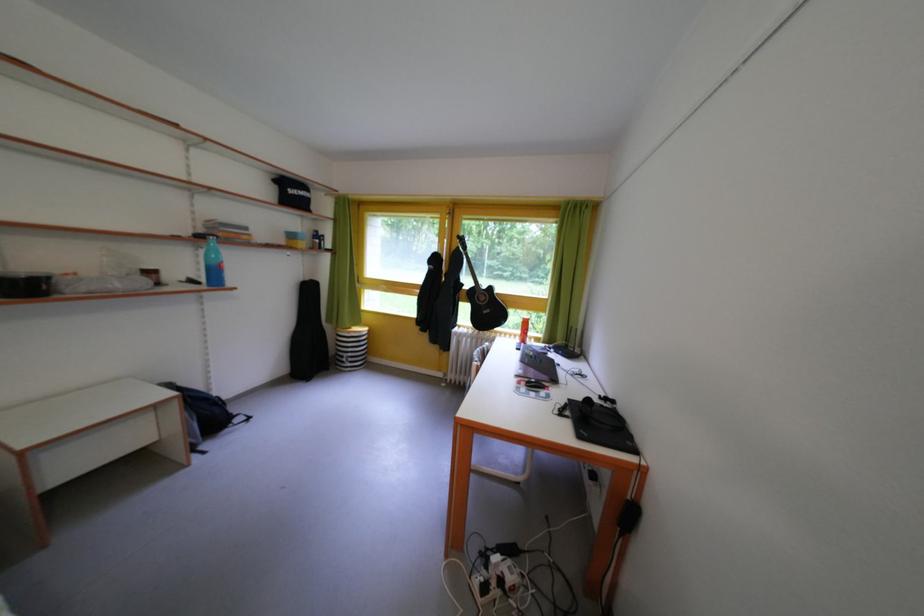
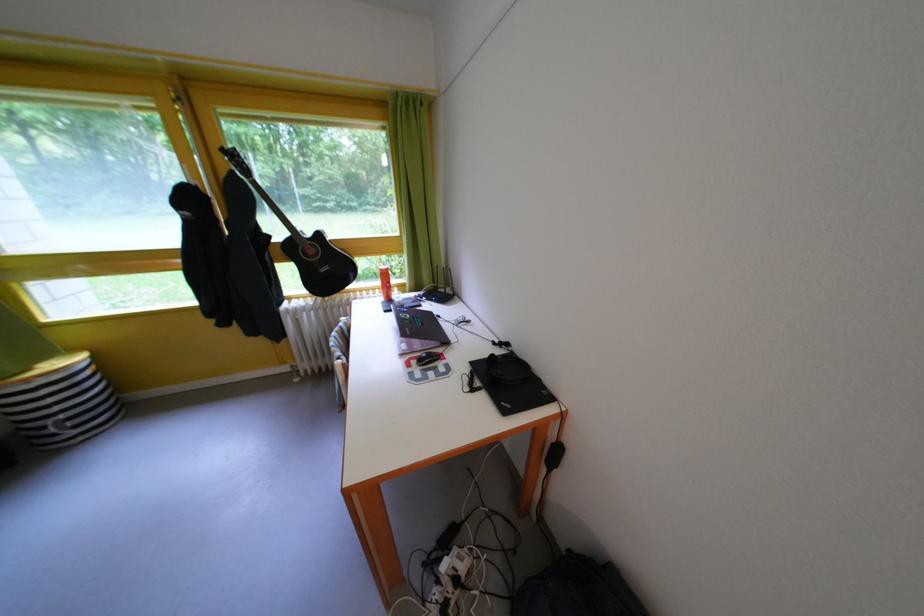
The images are taken continuously from a first-person perspective. In which direction is your viewpoint rotating?

The rotation direction of the camera is right-down.